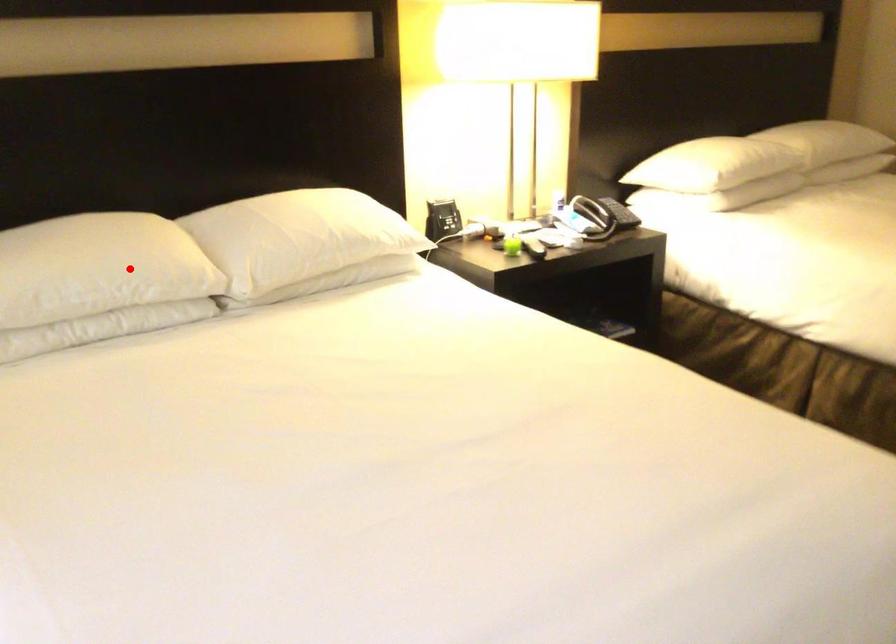
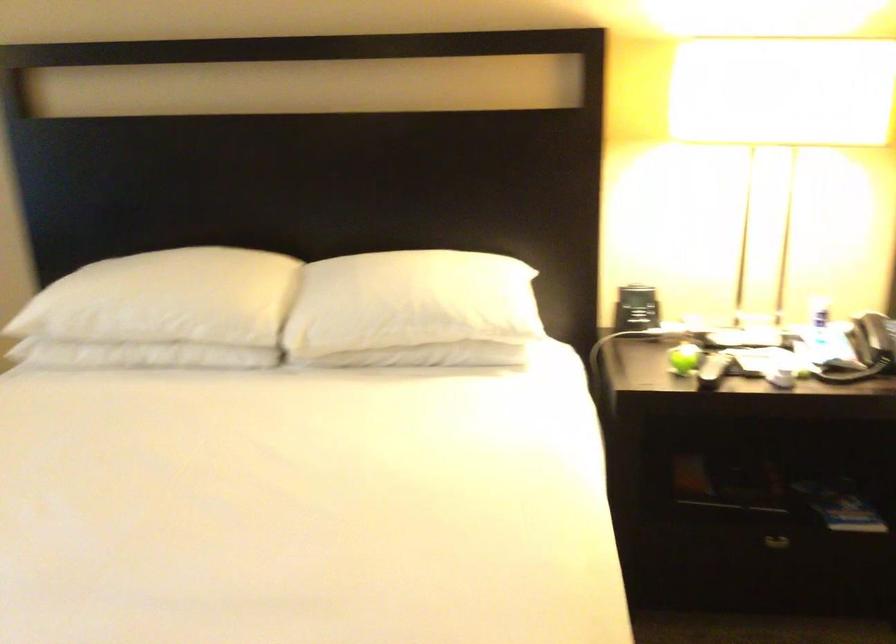
Locate, in the second image, the point that corresponds to the highlighted location in the first image.

(186, 305)